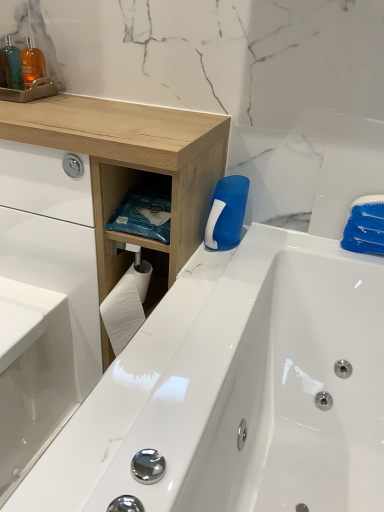
Describe the element at coordinates (132, 170) in the screenshot. I see `natural wood counter at upper left` at that location.

What is the approximate width of blue plastic cleaning brush at upper right?

3.53 inches.

The image size is (384, 512). In order to click on translucent plastic bottle at upper left in this screenshot , I will do `click(14, 63)`.

Measure the distance between translucent plastic bottle at upper left and camera.

translucent plastic bottle at upper left is 3.68 feet away from camera.

At what (x,y) coordinates should I click in order to perform the action: click on white glossy sink at lower left. Please return your answer as a coordinate pair (x, y). The image size is (384, 512). Looking at the image, I should click on click(x=32, y=376).

Locate an element on the screen. The height and width of the screenshot is (512, 384). natural wood counter at upper left is located at coordinates (132, 170).

Which of these two, translucent plastic bottle at upper left or white glossy sink at lower left, is smaller?

translucent plastic bottle at upper left.

Based on the photo, would you say translucent plastic bottle at upper left is inside or outside white glossy sink at lower left?

translucent plastic bottle at upper left is spatially situated outside white glossy sink at lower left.

In the image, is translucent plastic bottle at upper left on the left side or the right side of white glossy sink at lower left?

Clearly, translucent plastic bottle at upper left is on the left of white glossy sink at lower left in the image.

Are blue plastic cleaning brush at upper right and natural wood counter at upper left beside each other?

blue plastic cleaning brush at upper right and natural wood counter at upper left are clearly separated.

Which object is more forward, blue plastic cleaning brush at upper right or natural wood counter at upper left?

natural wood counter at upper left is closer to the camera.

Considering the relative sizes of blue plastic cleaning brush at upper right and natural wood counter at upper left in the image provided, is blue plastic cleaning brush at upper right shorter than natural wood counter at upper left?

Indeed, blue plastic cleaning brush at upper right has a lesser height compared to natural wood counter at upper left.

From a real-world perspective, between blue plastic cleaning brush at upper right and natural wood counter at upper left, who is vertically lower?

In real-world perspective, natural wood counter at upper left is lower.

Are natural wood counter at upper left and blue plastic cleaning brush at upper right located far from each other?

No, natural wood counter at upper left is in close proximity to blue plastic cleaning brush at upper right.

Can you confirm if natural wood counter at upper left is positioned to the right of blue plastic cleaning brush at upper right?

No.

In the image, is natural wood counter at upper left positioned in front of or behind blue plastic cleaning brush at upper right?

Visually, natural wood counter at upper left is located in front of blue plastic cleaning brush at upper right.

Where is `cleaning product lying above the natural wood counter at upper left (from the image's perspective)`? cleaning product lying above the natural wood counter at upper left (from the image's perspective) is located at coordinates coord(227,213).

Is white glossy sink at lower left in contact with natural wood counter at upper left?

No, white glossy sink at lower left is not making contact with natural wood counter at upper left.

What's the angular difference between white glossy sink at lower left and natural wood counter at upper left's facing directions?

There is a 0.211-degree angle between the facing directions of white glossy sink at lower left and natural wood counter at upper left.

From the image's perspective, relative to natural wood counter at upper left, is white glossy sink at lower left above or below?

white glossy sink at lower left is below natural wood counter at upper left.

Considering the sizes of objects white glossy sink at lower left and natural wood counter at upper left in the image provided, who is shorter, white glossy sink at lower left or natural wood counter at upper left?

With less height is white glossy sink at lower left.

Is there a large distance between translucent plastic bottle at upper left and blue plastic cleaning brush at upper right?

No, translucent plastic bottle at upper left is not far from blue plastic cleaning brush at upper right.

Does translucent plastic bottle at upper left have a lesser height compared to blue plastic cleaning brush at upper right?

In fact, translucent plastic bottle at upper left may be taller than blue plastic cleaning brush at upper right.

Consider the image. Considering the relative sizes of translucent plastic bottle at upper left and blue plastic cleaning brush at upper right in the image provided, is translucent plastic bottle at upper left wider than blue plastic cleaning brush at upper right?

In fact, translucent plastic bottle at upper left might be narrower than blue plastic cleaning brush at upper right.

Which object is further away from the camera, translucent plastic bottle at upper left or blue plastic cleaning brush at upper right?

Positioned behind is translucent plastic bottle at upper left.

Is white glossy sink at lower left surrounding blue plastic cleaning brush at upper right?

No, blue plastic cleaning brush at upper right is not surrounded by white glossy sink at lower left.

From the image's perspective, does white glossy sink at lower left appear lower than blue plastic cleaning brush at upper right?

Yes, from the image's perspective, white glossy sink at lower left is below blue plastic cleaning brush at upper right.

Does white glossy sink at lower left appear on the left side of blue plastic cleaning brush at upper right?

Yes.

Considering the relative sizes of white glossy sink at lower left and blue plastic cleaning brush at upper right in the image provided, is white glossy sink at lower left wider than blue plastic cleaning brush at upper right?

Yes, white glossy sink at lower left is wider than blue plastic cleaning brush at upper right.

Does natural wood counter at upper left have a larger size compared to translucent plastic bottle at upper left?

Correct, natural wood counter at upper left is larger in size than translucent plastic bottle at upper left.

Is natural wood counter at upper left wider or thinner than translucent plastic bottle at upper left?

natural wood counter at upper left is wider than translucent plastic bottle at upper left.

Between natural wood counter at upper left and translucent plastic bottle at upper left, which one appears on the left side from the viewer's perspective?

translucent plastic bottle at upper left.

Which is behind, point (103, 367) or point (13, 64)?

The point (103, 367) is farther.

The height and width of the screenshot is (512, 384). I want to click on sink on the right of translucent plastic bottle at upper left, so click(32, 376).

Where is `counter on the left of the blue plastic cleaning brush at upper right`? counter on the left of the blue plastic cleaning brush at upper right is located at coordinates (132, 170).

Estimate the real-world distances between objects in this image. Which object is closer to white glossy sink at lower left, blue plastic cleaning brush at upper right or natural wood counter at upper left?

Based on the image, natural wood counter at upper left appears to be nearer to white glossy sink at lower left.

When comparing their distances from blue plastic cleaning brush at upper right, does translucent plastic bottle at upper left or natural wood counter at upper left seem closer?

natural wood counter at upper left is positioned closer to the anchor blue plastic cleaning brush at upper right.

Looking at the image, which one is located closer to translucent plastic bottle at upper left, blue plastic cleaning brush at upper right or natural wood counter at upper left?

natural wood counter at upper left lies closer to translucent plastic bottle at upper left than the other object.

When comparing their distances from natural wood counter at upper left, does white glossy sink at lower left or blue plastic cleaning brush at upper right seem closer?

blue plastic cleaning brush at upper right lies closer to natural wood counter at upper left than the other object.

Looking at the image, which one is located closer to blue plastic cleaning brush at upper right, white glossy sink at lower left or translucent plastic bottle at upper left?

Based on the image, white glossy sink at lower left appears to be nearer to blue plastic cleaning brush at upper right.

From the image, which object appears to be farther from natural wood counter at upper left, translucent plastic bottle at upper left or white glossy sink at lower left?

translucent plastic bottle at upper left lies further to natural wood counter at upper left than the other object.

From the image, which object appears to be farther from translucent plastic bottle at upper left, natural wood counter at upper left or blue plastic cleaning brush at upper right?

The object further to translucent plastic bottle at upper left is blue plastic cleaning brush at upper right.

Consider the image. Based on their spatial positions, is white glossy sink at lower left or natural wood counter at upper left further from translucent plastic bottle at upper left?

white glossy sink at lower left lies further to translucent plastic bottle at upper left than the other object.

This screenshot has width=384, height=512. What are the coordinates of `counter between white glossy sink at lower left and blue plastic cleaning brush at upper right from left to right` in the screenshot? It's located at (132, 170).

The image size is (384, 512). Find the location of `cleaning product between translucent plastic bottle at upper left and white glossy sink at lower left vertically`. cleaning product between translucent plastic bottle at upper left and white glossy sink at lower left vertically is located at coordinates (x=227, y=213).

Image resolution: width=384 pixels, height=512 pixels. In order to click on counter between translucent plastic bottle at upper left and blue plastic cleaning brush at upper right in the horizontal direction in this screenshot , I will do `click(132, 170)`.

Locate an element on the screen. counter between translucent plastic bottle at upper left and white glossy sink at lower left in the vertical direction is located at coordinates (132, 170).